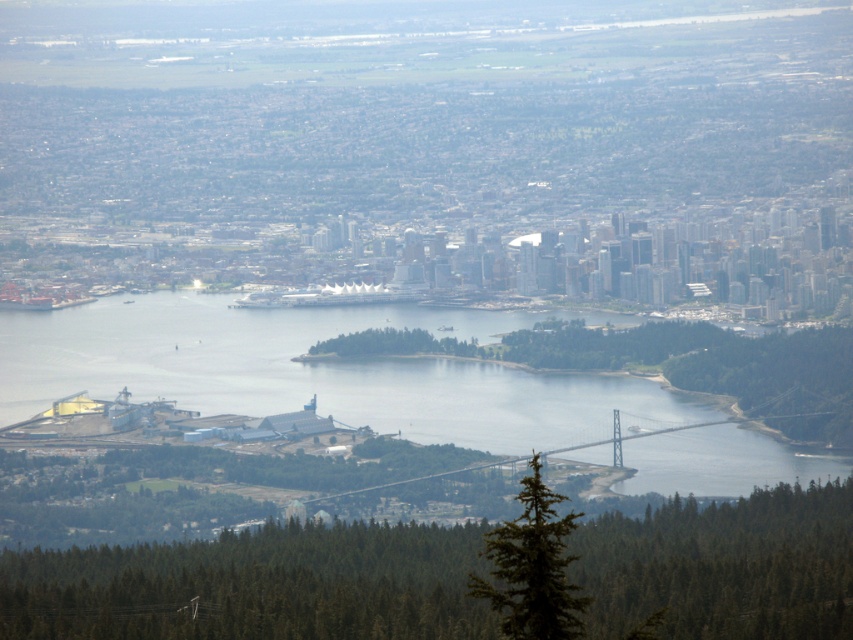
You are a drone operator planning to fly a drone with a 20 meter wingspan between the green textured tree at lower center and the clear water at lower center. Based on the scene, can the drone safely pass through the space between them without touching either?

The distance between the green textured tree at lower center and the clear water at lower center is 30.62 meters. Since the drone has a 20 meter wingspan, there is sufficient space for it to pass safely between them.

You are a photographer planning to capture the reflection of the green textured tree at lower right in the clear water at lower center. Based on the scene, is the tree visible in the water?

The clear water at lower center is positioned over green textured tree at lower right, so the tree is likely reflected in the water since the water is clear and the tree is positioned beneath it.

You are a photographer trying to capture a shot of the green textured tree at lower center and the clear water at lower center. Based on their positions, which object would appear closer to the camera in the photo?

The green textured tree at lower center appears closer to the camera because it is positioned below the clear water at lower center, indicating it is in a lower elevation relative to the water.